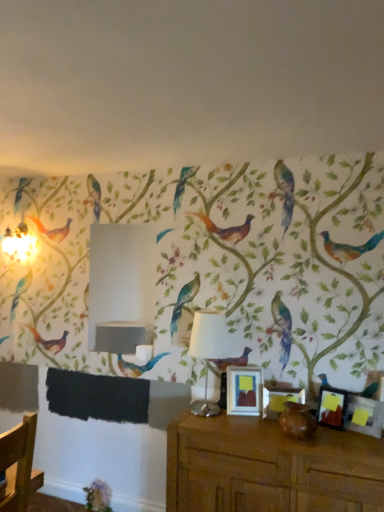
Question: Does point (309, 406) appear closer or farther from the camera than point (367, 432)?

Choices:
 (A) closer
 (B) farther

Answer: (B)

Question: Based on their positions, is brown matte vase at lower center located to the left or right of matte black picture frame at lower right, the 1th picture frame from the right?

Choices:
 (A) left
 (B) right

Answer: (A)

Question: Which of these objects is positioned farthest from the matte wooden picture frame at center, the second picture frame viewed from the left?

Choices:
 (A) brown wooden table at lower right
 (B) white fabric lampshade at center
 (C) matte silver picture frame at center, arranged as the 4th picture frame when viewed from the right
 (D) matte black picture frame at right, which ranks as the 2th picture frame in right-to-left order
 (E) matte black picture frame at lower right, the fourth picture frame in the left-to-right sequence

Answer: (B)

Question: Which is farther from the matte black picture frame at lower right, the 1th picture frame from the right?

Choices:
 (A) white fabric lampshade at center
 (B) matte silver picture frame at center, which appears as the first picture frame when viewed from the left
 (C) brown matte vase at lower center
 (D) brown wooden table at lower right
 (E) matte black picture frame at right, which ranks as the 2th picture frame in right-to-left order

Answer: (A)